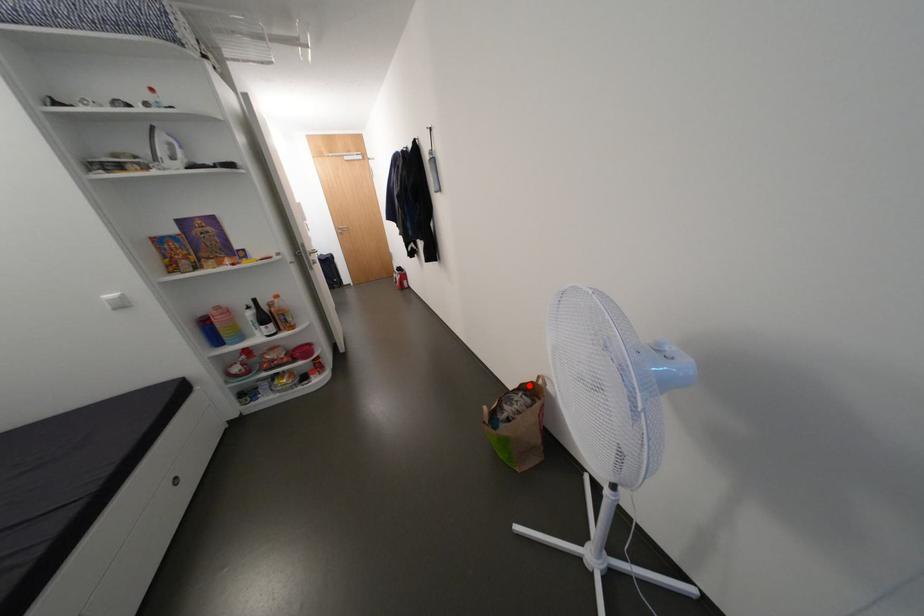
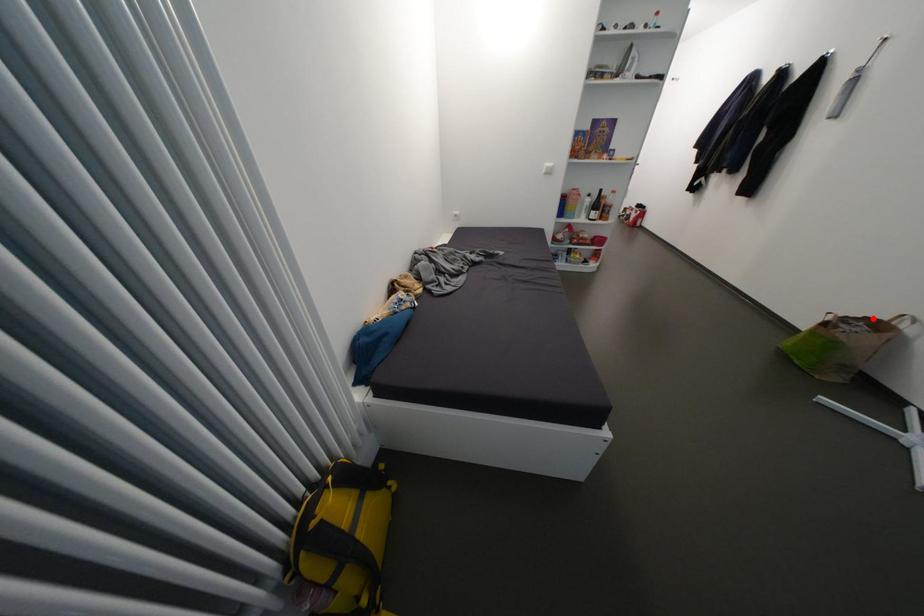
I am providing you with two images of the same scene from different viewpoints. A red point is marked on the first image and another point is marked on the second image. Does the point marked in image1 correspond to the same location as the one in image2?

Yes